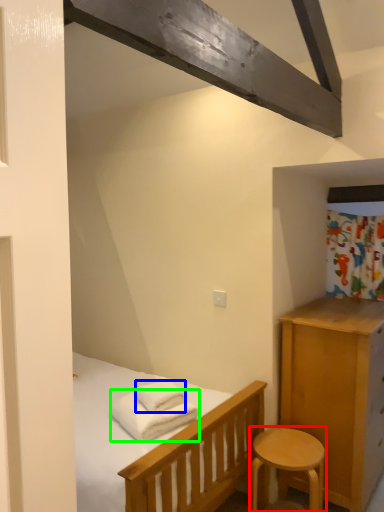
Question: Estimate the real-world distances between objects in this image. Which object is farther from stool (highlighted by a red box), bath towel (highlighted by a blue box) or bath towel (highlighted by a green box)?

Choices:
 (A) bath towel
 (B) bath towel

Answer: (A)